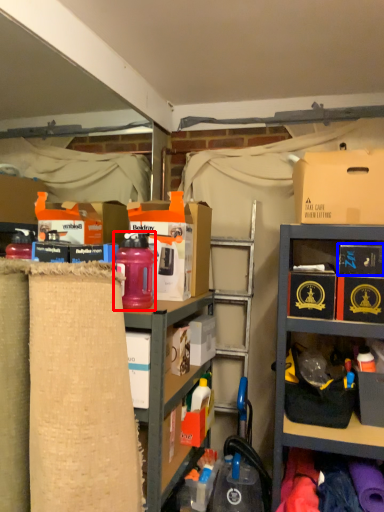
Question: Which object is closer to the camera taking this photo, bottle (highlighted by a red box) or storage box (highlighted by a blue box)?

Choices:
 (A) bottle
 (B) storage box

Answer: (A)